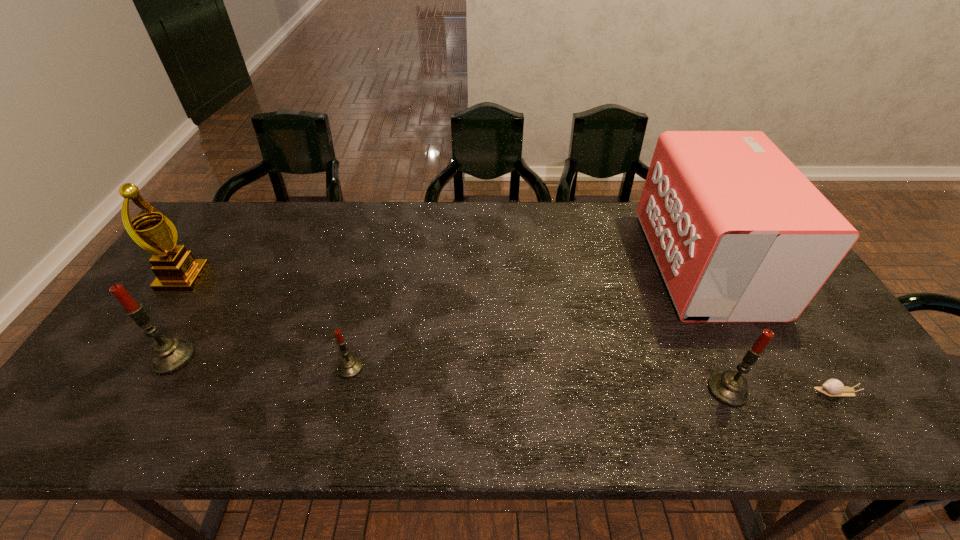
Locate an element on the screen. The width and height of the screenshot is (960, 540). blank area located on the back of the second shortest candle is located at coordinates (671, 264).

This screenshot has width=960, height=540. I want to click on free space located 0.250m on the front-facing side of the award, so click(287, 278).

In order to click on vacant space located on the surface of the box where the text is embossed in this screenshot , I will do `click(533, 264)`.

I want to click on blank space located on the surface of the box where the text is embossed, so click(605, 264).

Locate an element on the screen. free space located 0.150m on the surface of the box where the text is embossed is located at coordinates (602, 264).

I want to click on free space located on the shell of the shortest object, so click(x=764, y=392).

You are a GUI agent. You are given a task and a screenshot of the screen. Output one action in this format:
    pyautogui.click(x=<x>, y=<y>)
    Task: Click on the free location located 0.230m on the shell of the shortest object
    
    Given the screenshot: What is the action you would take?
    [717, 392]

Where is `blank space located on the shell of the shortest object`? The image size is (960, 540). blank space located on the shell of the shortest object is located at coordinates (722, 392).

I want to click on object situated at the far edge, so click(739, 234).

At what (x,y) coordinates should I click in order to perform the action: click on escargot that is at the near edge. Please return your answer as a coordinate pair (x, y). Image resolution: width=960 pixels, height=540 pixels. Looking at the image, I should click on tap(832, 387).